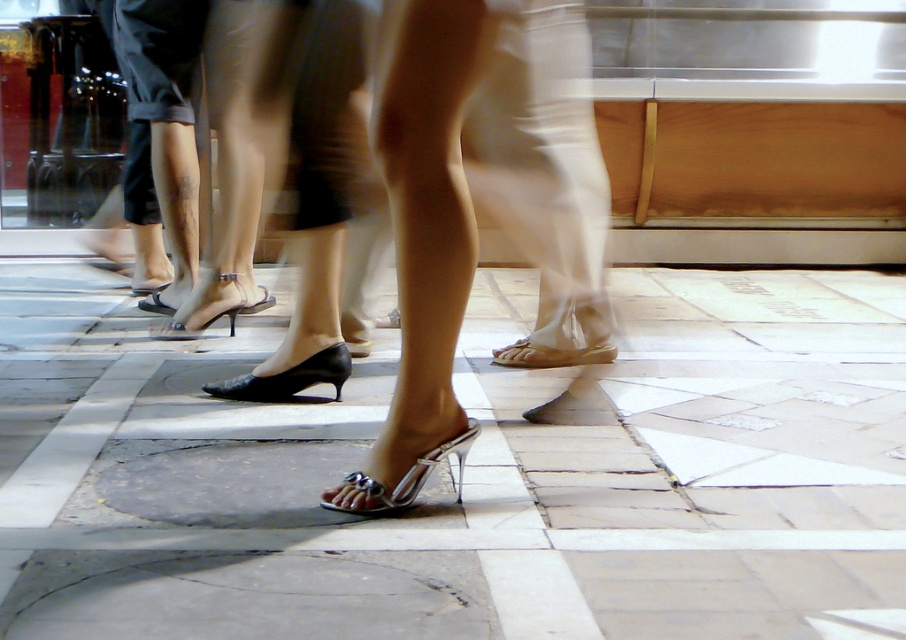
Can you confirm if black leather shoe at center is taller than beige fabric sandal at center?

Yes, black leather shoe at center is taller than beige fabric sandal at center.

Does point (249, 396) come farther from viewer compared to point (605, 362)?

That is False.

Where is `black leather shoe at center`? This screenshot has width=906, height=640. black leather shoe at center is located at coordinates (288, 378).

What do you see at coordinates (400, 481) in the screenshot?
I see `silver metallic sandal at center` at bounding box center [400, 481].

Can you confirm if silver metallic sandal at center is positioned below black leather sandal at center?

Yes, silver metallic sandal at center is below black leather sandal at center.

Where is `silver metallic sandal at center`? The image size is (906, 640). silver metallic sandal at center is located at coordinates (400, 481).

Where is `silver metallic sandal at center`? silver metallic sandal at center is located at coordinates (400, 481).

Is white stone pavement at center wider than black leather shoe at center?

Correct, the width of white stone pavement at center exceeds that of black leather shoe at center.

Who is more forward, (576, 477) or (341, 356)?

Point (576, 477) is in front.

Locate an element on the screen. This screenshot has height=640, width=906. white stone pavement at center is located at coordinates (464, 474).